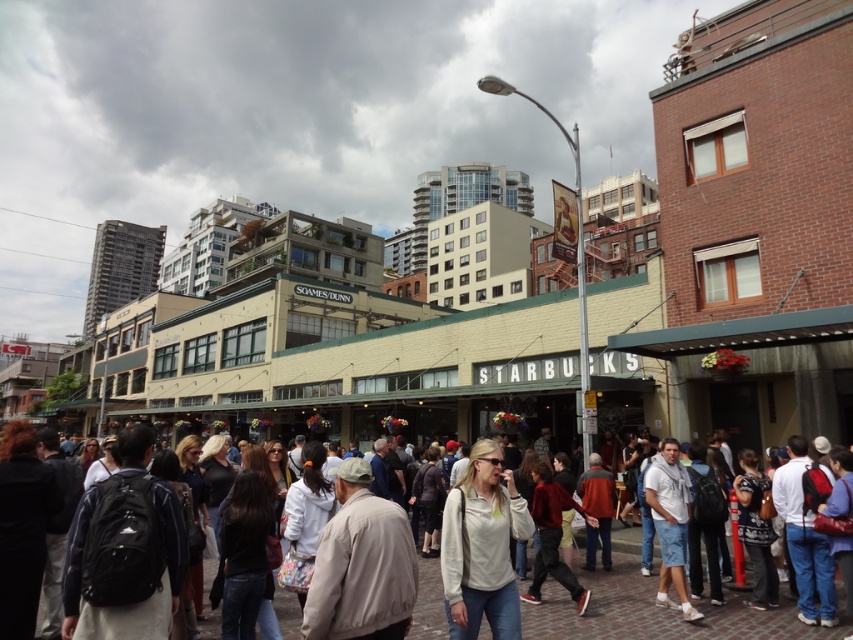
Question: Which point is farther to the camera?

Choices:
 (A) (564, 627)
 (B) (519, 614)

Answer: (A)

Question: Considering the relative positions of white cotton shirt at center and white matte jacket at center in the image provided, where is white cotton shirt at center located with respect to white matte jacket at center?

Choices:
 (A) above
 (B) below

Answer: (B)

Question: Among these objects, which one is farthest from the camera?

Choices:
 (A) white matte jacket at center
 (B) white cotton shirt at center

Answer: (B)

Question: Is white cotton shirt at center in front of white matte jacket at center?

Choices:
 (A) yes
 (B) no

Answer: (B)

Question: Can you confirm if white cotton shirt at center is positioned to the left of white matte jacket at center?

Choices:
 (A) yes
 (B) no

Answer: (A)